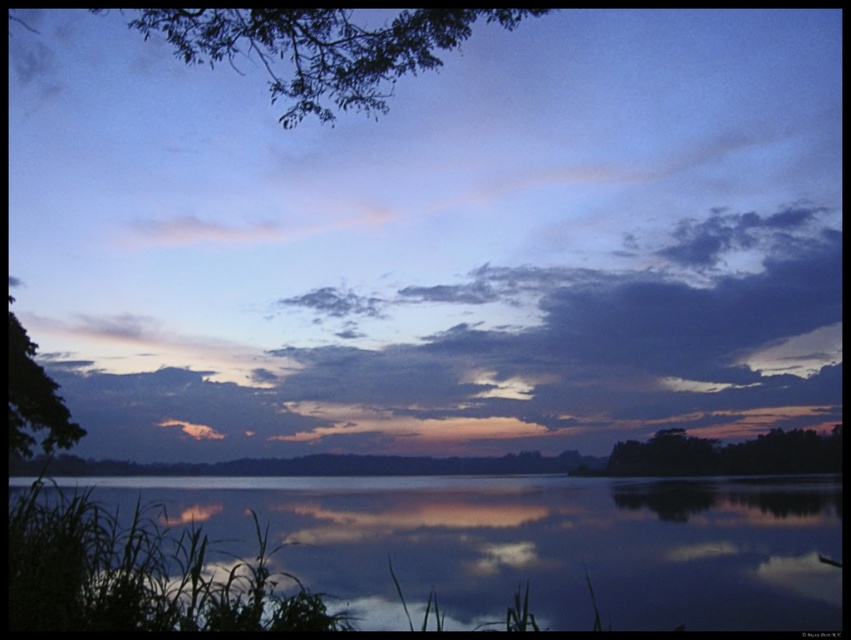
Question: Which object appears farthest from the camera in this image?

Choices:
 (A) smooth water at lower center
 (B) green leafy tree at upper left
 (C) dark green leafy tree at upper left
 (D) dark green leafy tree at right

Answer: (D)

Question: Which of the following is the farthest from the observer?

Choices:
 (A) (610, 374)
 (B) (444, 532)

Answer: (A)

Question: Does dark green leafy tree at right appear on the right side of dark green leafy tree at upper left?

Choices:
 (A) no
 (B) yes

Answer: (B)

Question: Which of these objects is positioned closest to the cloudy sky at upper center?

Choices:
 (A) dark green leafy tree at right
 (B) smooth water at lower center

Answer: (A)

Question: Can you confirm if smooth water at lower center is wider than dark green leafy tree at right?

Choices:
 (A) yes
 (B) no

Answer: (A)

Question: Does dark green leafy tree at right appear under dark green leafy tree at upper left?

Choices:
 (A) yes
 (B) no

Answer: (A)